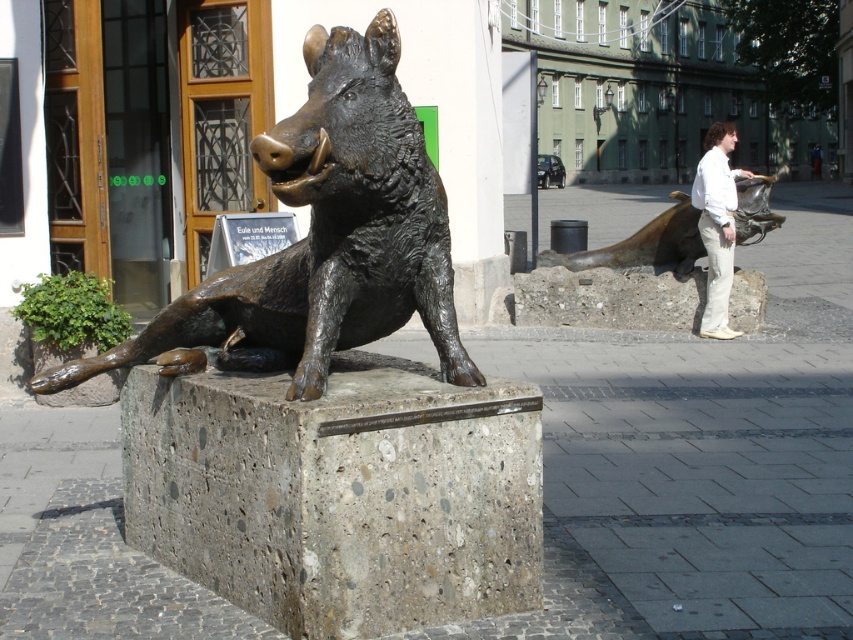
Question: Does bronze statue at right come behind white cotton pants at right?

Choices:
 (A) no
 (B) yes

Answer: (B)

Question: Among these objects, which one is farthest from the camera?

Choices:
 (A) bronze statue of a boar at center
 (B) bronze statue at right

Answer: (B)

Question: Is bronze statue of a boar at center positioned in front of bronze statue at right?

Choices:
 (A) yes
 (B) no

Answer: (A)

Question: Is bronze statue of a boar at center smaller than white cotton pants at right?

Choices:
 (A) yes
 (B) no

Answer: (B)

Question: Which object is positioned closest to the bronze statue of a boar at center?

Choices:
 (A) white cotton pants at right
 (B) bronze statue at right

Answer: (A)

Question: Among these points, which one is nearest to the camera?

Choices:
 (A) (701, 166)
 (B) (689, 196)

Answer: (A)